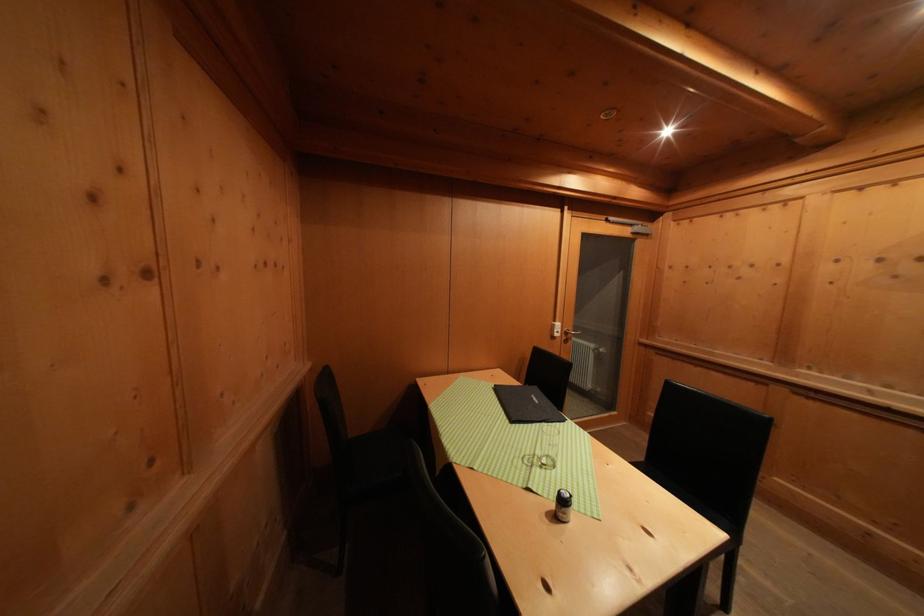
Where is `clear drinking glass`? The height and width of the screenshot is (616, 924). clear drinking glass is located at coordinates (548, 446).